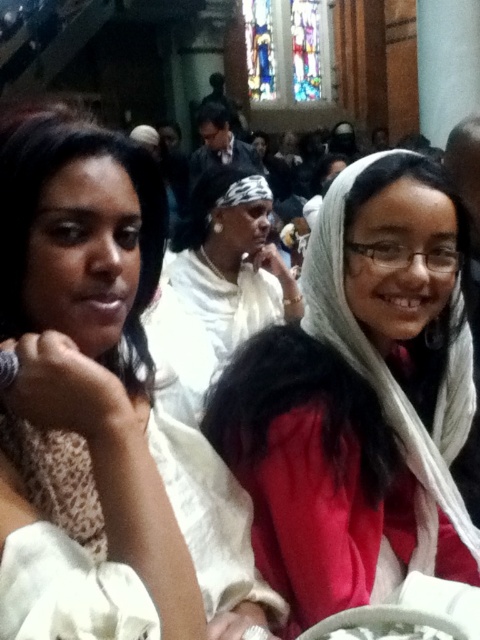
You are an interior designer observing the scene. You need to adjust the lighting to highlight the white fabric scarf at center without obscuring the red matte scarf at center. Given their spatial relationship, where should you position the light source?

The white fabric scarf at center is in front of the red matte scarf at center. To highlight the white scarf while keeping the red one visible, position the light source behind the white fabric scarf at center so it casts a silhouette, allowing the red matte scarf at center to show through the gaps.

You are standing at the back of the church and want to hand a note to the person wearing the white fabric scarf at center and the white fabric headscarf at center. Can you throw the note to both of them in one throw?

The distance between the white fabric scarf at center and the white fabric headscarf at center is 9.03 meters. Since they are 9.03 meters apart, you would need to make two separate throws to reach both individuals.